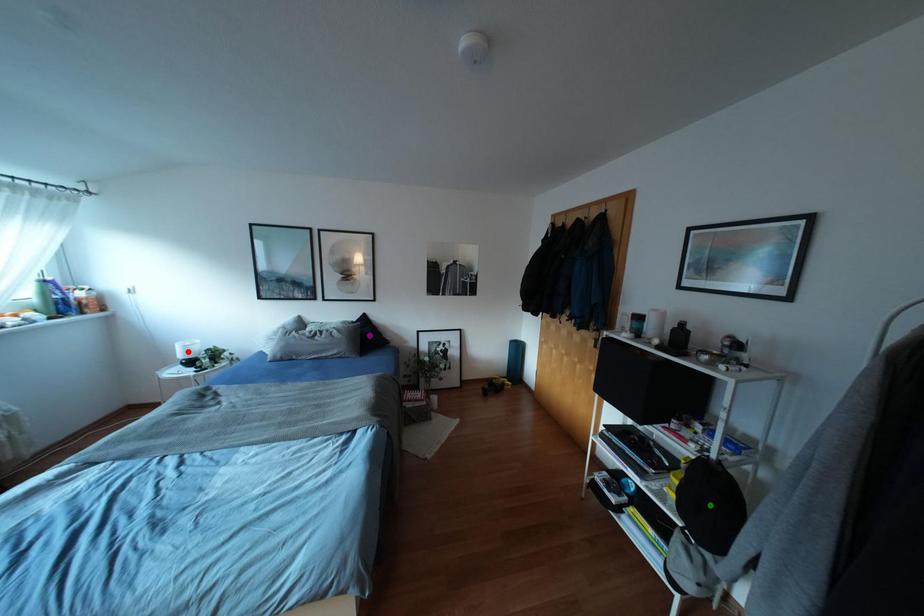
Order these from farthest to nearest:
- purple point
- green point
- red point

purple point < red point < green point